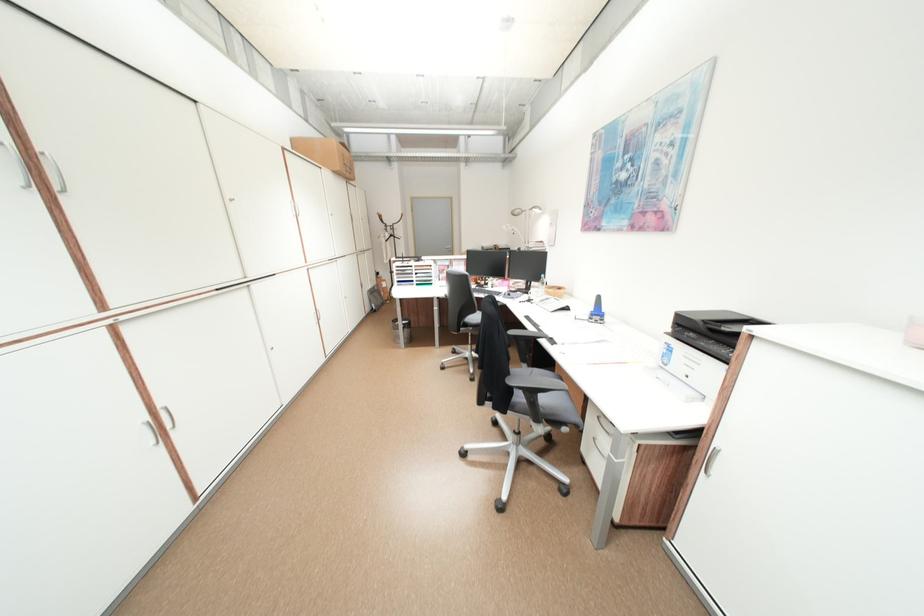
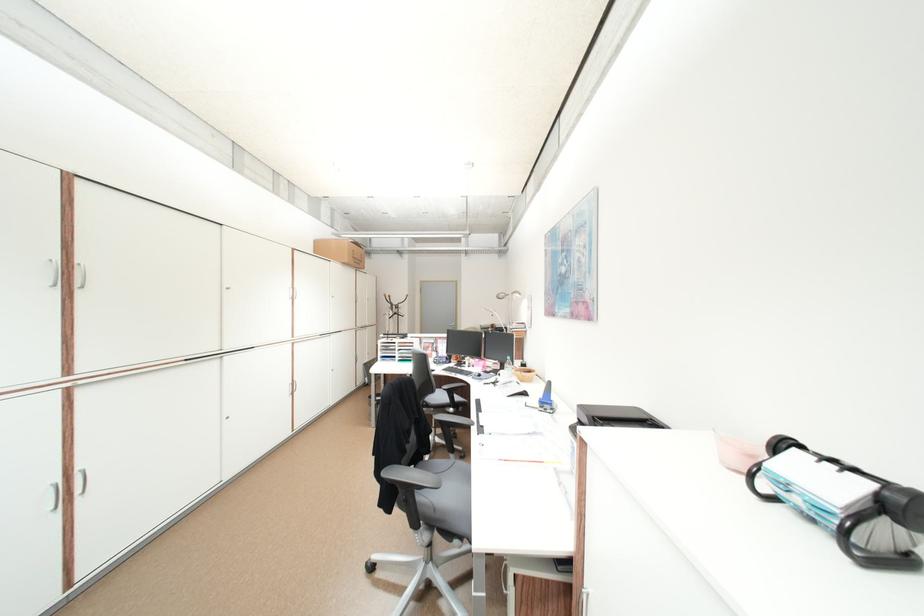
The point at (347,169) is marked in the first image. Where is the corresponding point in the second image?

(356, 262)